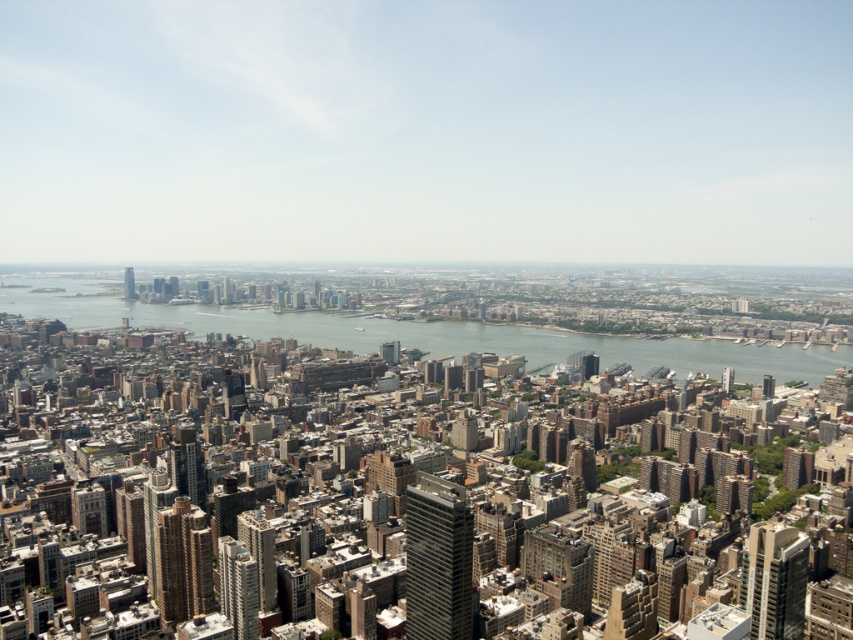
Does glassy silver skyscraper at center-right appear under metallic glass skyscraper at center?

Indeed, glassy silver skyscraper at center-right is positioned under metallic glass skyscraper at center.

Who is taller, glassy silver skyscraper at center-right or metallic glass skyscraper at center?

With more height is glassy silver skyscraper at center-right.

Locate an element on the screen. The height and width of the screenshot is (640, 853). glassy silver skyscraper at center-right is located at coordinates (776, 580).

Can you confirm if clear blue water at center is bigger than matte glass skyscraper at center-left?

Yes.

Who is more forward, [749,372] or [129,278]?

Positioned in front is point [129,278].

Image resolution: width=853 pixels, height=640 pixels. Find the location of `clear blue water at center`. clear blue water at center is located at coordinates (425, 333).

Which is above, glassy silver skyscraper at center-right or gold reflective skyscraper at center-left?

gold reflective skyscraper at center-left

Describe the element at coordinates (776, 580) in the screenshot. This screenshot has height=640, width=853. I see `glassy silver skyscraper at center-right` at that location.

Find the location of a particular element. glassy silver skyscraper at center-right is located at coordinates (776, 580).